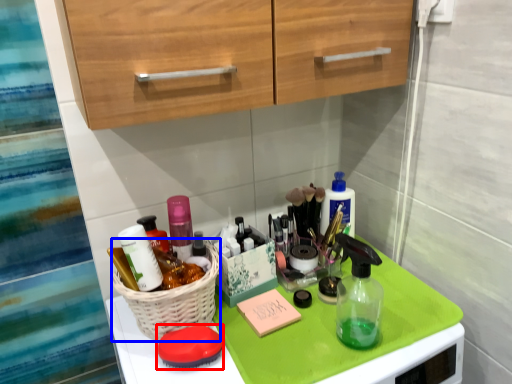
Question: Which object is closer to the camera taking this photo, soap (highlighted by a red box) or basket (highlighted by a blue box)?

Choices:
 (A) soap
 (B) basket

Answer: (B)